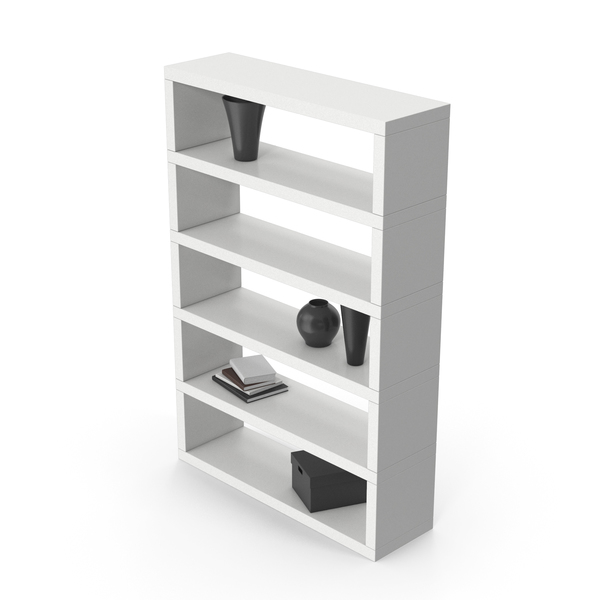
The height and width of the screenshot is (600, 600). What are the coordinates of `stack of books` in the screenshot? It's located at (249, 385).